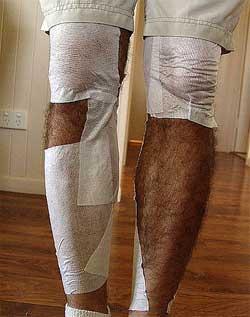
The image size is (250, 317). In order to click on wood floor in this screenshot , I will do `click(118, 273)`, `click(26, 264)`, `click(230, 219)`.